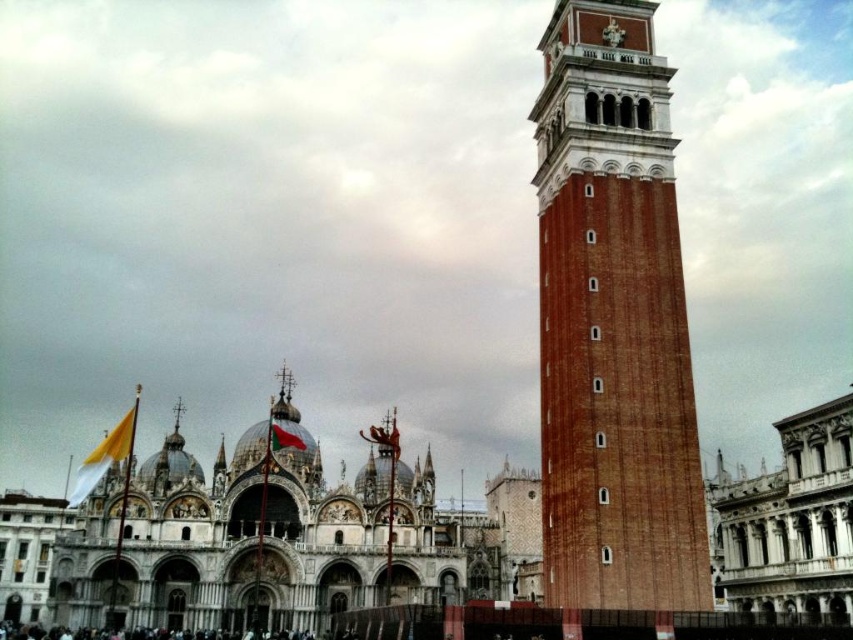
Between brick textured bell tower at right and red fabric flag at center, which one has less height?

Standing shorter between the two is red fabric flag at center.

Who is lower down, brick textured bell tower at right or red fabric flag at center?

Positioned lower is red fabric flag at center.

Who is more distant from viewer, (x=635, y=276) or (x=276, y=426)?

Positioned behind is point (x=276, y=426).

Identify the location of brick textured bell tower at right. This screenshot has width=853, height=640. (613, 323).

Which is more to the right, white fabric flag at lower left or red fabric flag at center?

red fabric flag at center is more to the right.

Which is behind, point (131, 417) or point (288, 432)?

Positioned behind is point (131, 417).

Between point (88, 461) and point (276, 435), which one is positioned in front?

Point (276, 435) is more forward.

Find the location of a particular element. The image size is (853, 640). white fabric flag at lower left is located at coordinates (105, 456).

From the picture: Is brick textured bell tower at right thinner than white fabric flag at lower left?

Indeed, brick textured bell tower at right has a lesser width compared to white fabric flag at lower left.

Which is in front, point (567, 124) or point (111, 445)?

Point (567, 124) is in front.

Image resolution: width=853 pixels, height=640 pixels. Identify the location of brick textured bell tower at right. (613, 323).

Find the location of a particular element. brick textured bell tower at right is located at coordinates (613, 323).